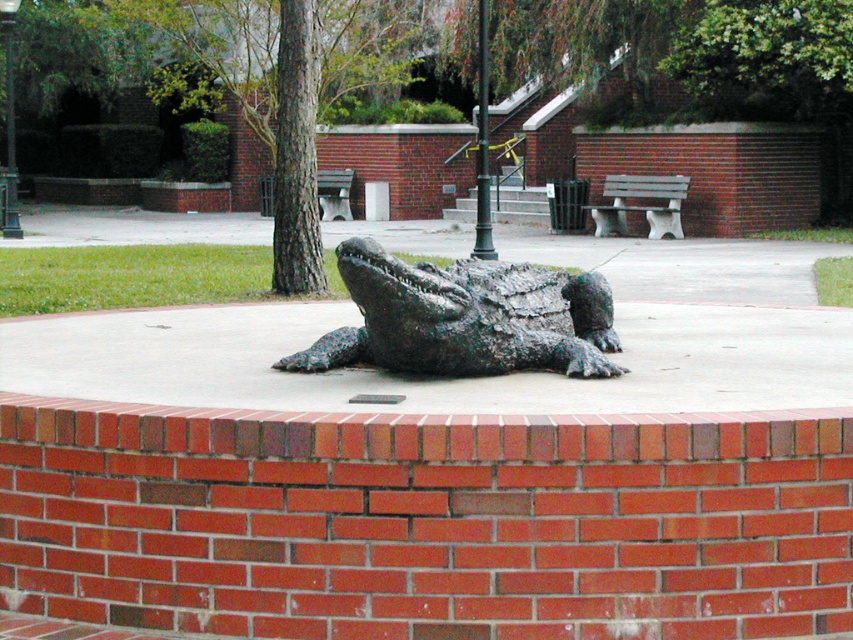
You are standing at the entrance of the park and see the shiny bronze crocodile at center. If you walk straight ahead, will you approach the crocodile or move away from it?

Since you are at the entrance and the shiny bronze crocodile at center is located at coordinates approximately halfway across the park, walking straight ahead would bring you closer to the crocodile.

You are a sculptor who wants to create a miniature version of the shiny bronze crocodile at center and the wooden bench at center. If you want both miniatures to be proportional to each other, which object should you scale down more?

The shiny bronze crocodile at center is smaller than the wooden bench at center in the original image, so to maintain proportion in the miniature versions, the wooden bench at center should be scaled down more than the crocodile since it is larger originally.

You are standing in the park near the alligator statue and want to place a small bench exactly at the point marked as point (x=445, y=365). If the bench is 3 feet wide, will it fit without overlapping the brick wall or the statue?

The point (x=445, y=365) is 22.81 feet away from the viewer. Since the bench is only 3 feet wide, there should be enough space between the point and the brick wall or the statue to place it without overlapping.